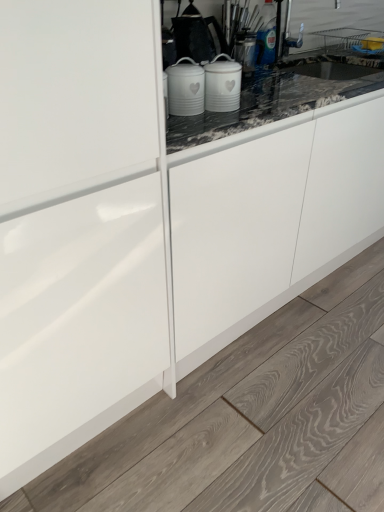
Question: Considering the positions of white matte canisters at center and white matte canisters at center in the image, is white matte canisters at center bigger or smaller than white matte canisters at center?

Choices:
 (A) small
 (B) big

Answer: (A)

Question: From the image's perspective, relative to white matte canisters at center, is white matte canisters at center above or below?

Choices:
 (A) above
 (B) below

Answer: (A)

Question: In the image, is white matte canisters at center positioned in front of or behind white matte canisters at center?

Choices:
 (A) front
 (B) behind

Answer: (B)

Question: Is white matte canisters at center in front of or behind white matte canisters at center in the image?

Choices:
 (A) front
 (B) behind

Answer: (A)

Question: From a real-world perspective, is white matte canisters at center above or below white matte canisters at center?

Choices:
 (A) below
 (B) above

Answer: (B)

Question: In terms of height, does white matte canisters at center look taller or shorter compared to white matte canisters at center?

Choices:
 (A) tall
 (B) short

Answer: (A)

Question: Is white matte canisters at center spatially inside white matte canisters at center, or outside of it?

Choices:
 (A) outside
 (B) inside

Answer: (A)